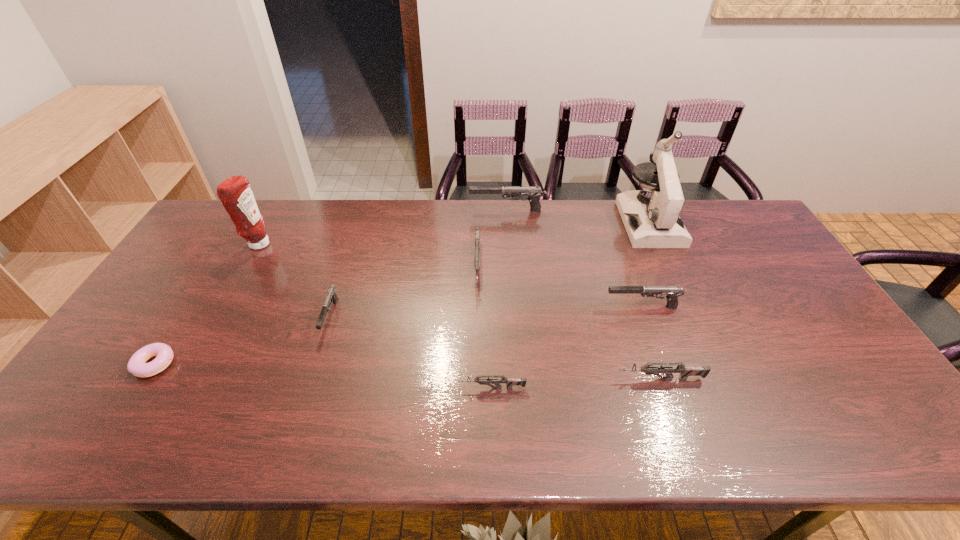
This screenshot has width=960, height=540. In order to click on the leftmost gray gun in this screenshot , I will do `click(331, 296)`.

This screenshot has width=960, height=540. In order to click on the second shortest object in this screenshot , I will do `click(481, 379)`.

I want to click on the nearest grey gun, so click(481, 379).

Locate an element on the screen. The height and width of the screenshot is (540, 960). the shortest object is located at coordinates (137, 365).

This screenshot has height=540, width=960. I want to click on purple doughnut, so click(x=137, y=365).

You are a GUI agent. You are given a task and a screenshot of the screen. Output one action in this format:
    pyautogui.click(x=<x>, y=<y>)
    Task: Click on the vacant space located at the eyepiece of the tallest object
    Image resolution: width=960 pixels, height=540 pixels.
    Given the screenshot: What is the action you would take?
    pyautogui.click(x=687, y=307)

The image size is (960, 540). What are the coordinates of `blank area located on the back of the second tallest object` in the screenshot? It's located at (271, 222).

You are a GUI agent. You are given a task and a screenshot of the screen. Output one action in this format:
    pyautogui.click(x=<x>, y=<y>)
    Task: Click on the free space located at the muzzle end of the farthest gray gun
    The width and height of the screenshot is (960, 540).
    Given the screenshot: What is the action you would take?
    pyautogui.click(x=368, y=211)

Locate an element on the screen. The height and width of the screenshot is (540, 960). free spot located at the muzzle end of the farthest gray gun is located at coordinates (390, 211).

Image resolution: width=960 pixels, height=540 pixels. In order to click on free space located 0.260m at the muzzle end of the farthest gray gun in this screenshot , I will do `click(398, 211)`.